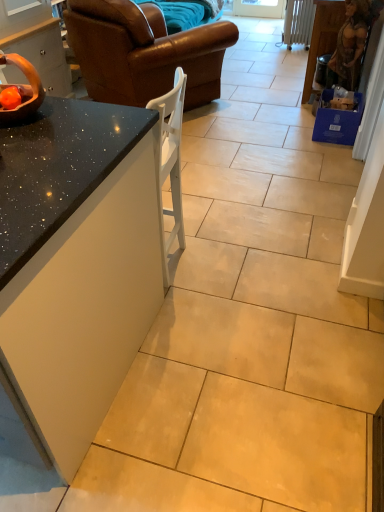
Identify the location of vacant space in front of wooden bowl at upper left. Image resolution: width=384 pixels, height=512 pixels. (28, 131).